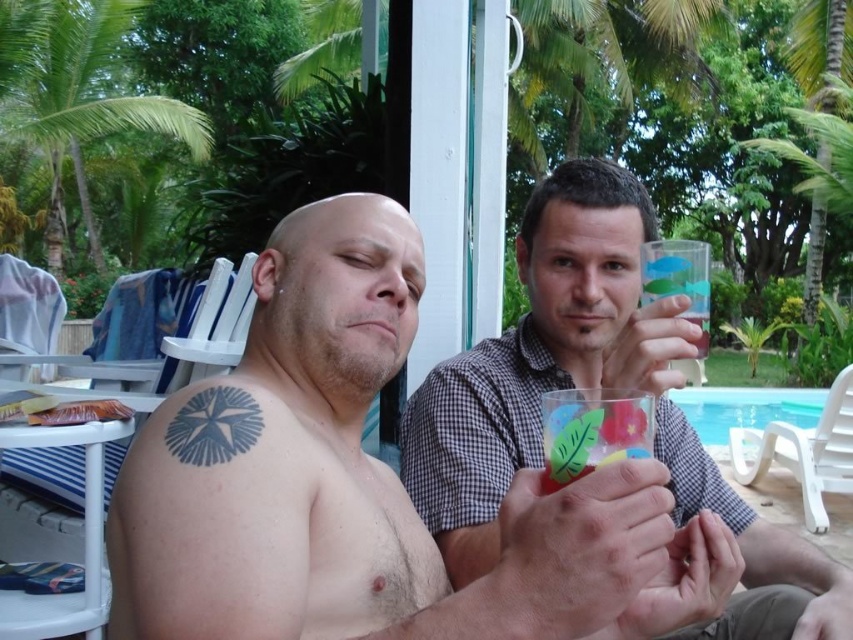
Question: Which point appears farthest from the camera in this image?

Choices:
 (A) (207, 358)
 (B) (817, 428)
 (C) (415, 442)
 (D) (241, 474)

Answer: (B)

Question: Can you confirm if shiny metallic cup at center is smaller than white plastic chair at lower right?

Choices:
 (A) no
 (B) yes

Answer: (B)

Question: Is black ink tattoo at upper left closer to camera compared to white plastic chair at lower right?

Choices:
 (A) no
 (B) yes

Answer: (B)

Question: Which point is farther to the camera?

Choices:
 (A) (233, 605)
 (B) (364, 241)
 (C) (715, 417)

Answer: (C)

Question: Which point appears closest to the camera in this image?

Choices:
 (A) (817, 488)
 (B) (669, 339)
 (C) (621, 454)

Answer: (C)

Question: Can you confirm if black ink tattoo at upper left is positioned to the right of translucent glass cup with colorful leaves at center?

Choices:
 (A) yes
 (B) no

Answer: (B)